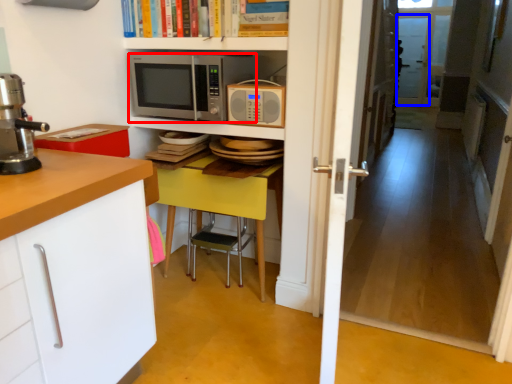
Question: Which point is closer to the camera, microwave oven (highlighted by a red box) or screen door (highlighted by a blue box)?

Choices:
 (A) microwave oven
 (B) screen door

Answer: (A)